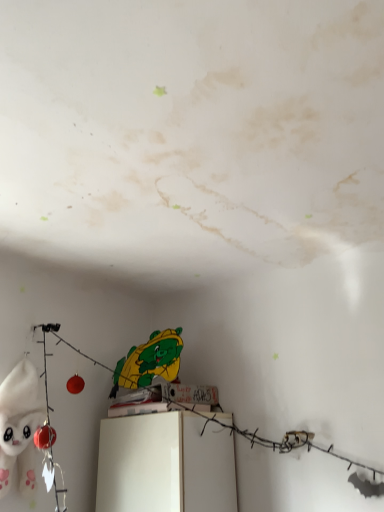
Question: From a real-world perspective, is white plush toy at left positioned above or below white glossy cabinet at center?

Choices:
 (A) above
 (B) below

Answer: (A)

Question: Relative to white glossy cabinet at center, is white plush toy at left in front or behind?

Choices:
 (A) behind
 (B) front

Answer: (B)

Question: In the image, is white plush toy at left on the left side or the right side of white glossy cabinet at center?

Choices:
 (A) right
 (B) left

Answer: (B)

Question: Based on their sizes in the image, would you say white glossy cabinet at center is bigger or smaller than white plush toy at left?

Choices:
 (A) big
 (B) small

Answer: (A)

Question: From the image's perspective, is white glossy cabinet at center above or below white plush toy at left?

Choices:
 (A) below
 (B) above

Answer: (A)

Question: Is point (193, 467) closer or farther from the camera than point (6, 392)?

Choices:
 (A) closer
 (B) farther

Answer: (B)

Question: In terms of width, does white glossy cabinet at center look wider or thinner when compared to white plush toy at left?

Choices:
 (A) wide
 (B) thin

Answer: (A)